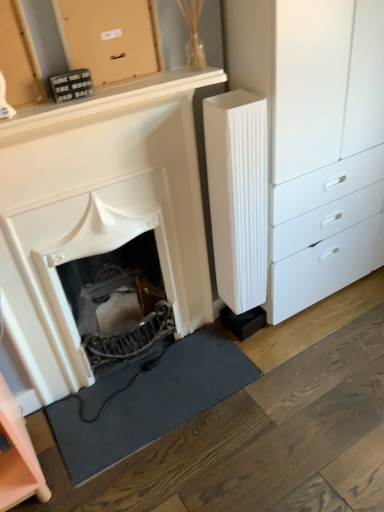
Image resolution: width=384 pixels, height=512 pixels. Find the location of `free spot in front of white ribbed radiator at right`. free spot in front of white ribbed radiator at right is located at coordinates (261, 355).